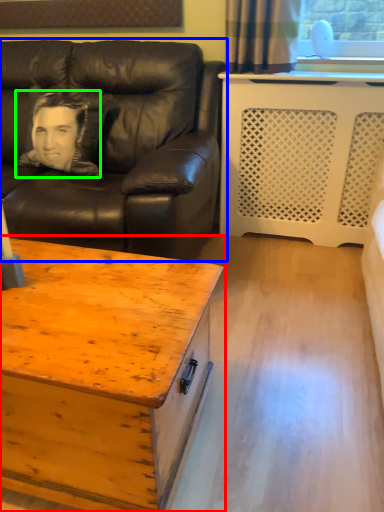
Question: Considering the real-world distances, which object is closest to coffee table (highlighted by a red box)? studio couch (highlighted by a blue box) or man (highlighted by a green box).

Choices:
 (A) studio couch
 (B) man

Answer: (A)